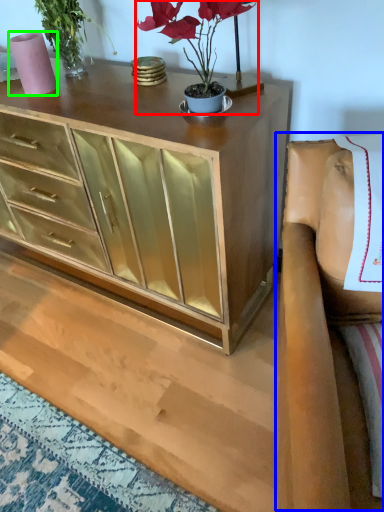
Question: Which is farther away from houseplant (highlighted by a red box)? armchair (highlighted by a blue box) or vase (highlighted by a green box)?

Choices:
 (A) armchair
 (B) vase

Answer: (B)